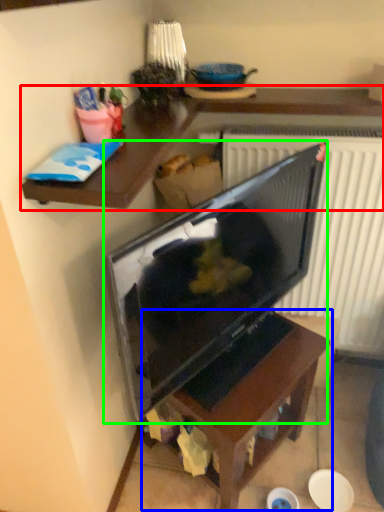
Question: Considering the real-world distances, which object is farthest from desk (highlighted by a red box)? table (highlighted by a blue box) or television (highlighted by a green box)?

Choices:
 (A) table
 (B) television

Answer: (A)